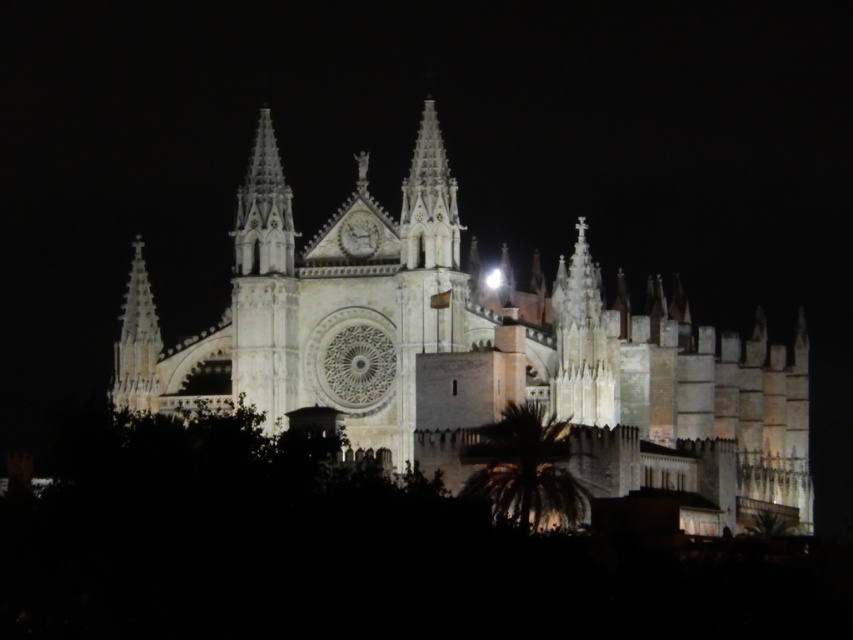
Question: Among these points, which one is nearest to the camera?

Choices:
 (A) (149, 337)
 (B) (288, 317)
 (C) (515, 492)

Answer: (C)

Question: Can you confirm if white stone church at center is thinner than smooth stone spire at center-left?

Choices:
 (A) no
 (B) yes

Answer: (A)

Question: Does white stone church at center appear on the right side of green leafy palm at lower center?

Choices:
 (A) no
 (B) yes

Answer: (B)

Question: Which of the following is the closest to the observer?

Choices:
 (A) smooth stone spire at center-left
 (B) green leafy palm at lower center
 (C) white stone church at center

Answer: (B)

Question: Does green leafy palm at lower center come in front of smooth stone spire at center-left?

Choices:
 (A) no
 (B) yes

Answer: (B)

Question: Which object is the closest to the white stone church at center?

Choices:
 (A) smooth stone spire at center-left
 (B) green leafy palm at lower center

Answer: (B)